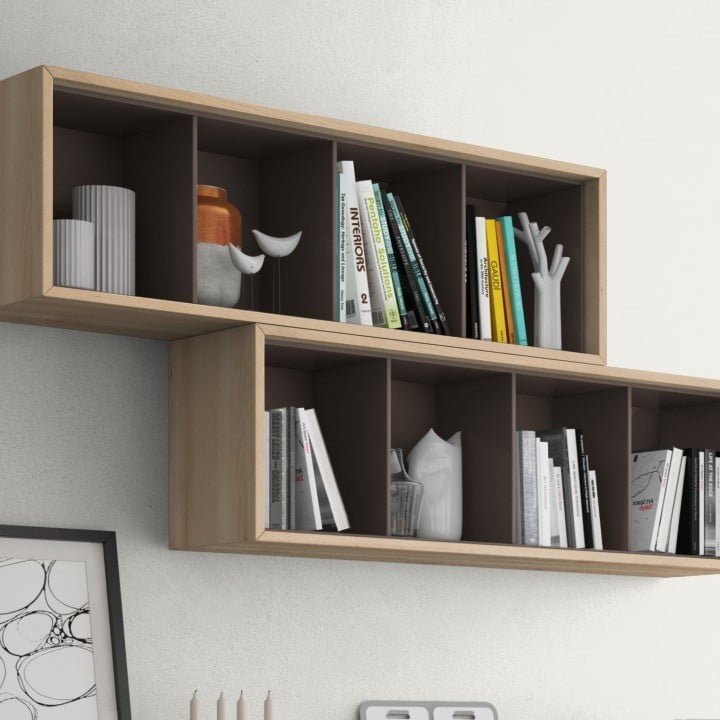
In order to click on art works in this screenshot , I will do `click(58, 260)`, `click(114, 238)`, `click(207, 188)`, `click(243, 253)`, `click(273, 240)`, `click(543, 278)`, `click(446, 463)`, `click(405, 500)`, `click(12, 657)`, `click(420, 701)`.